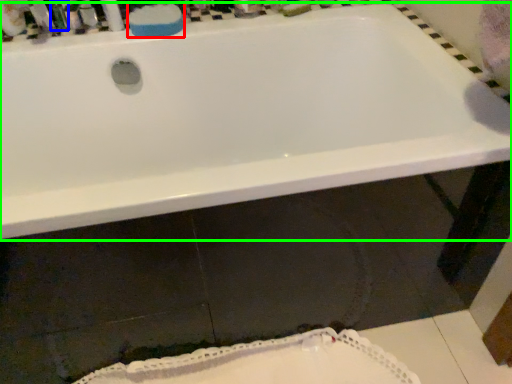
Question: Estimate the real-world distances between objects in this image. Which object is closer to soap (highlighted by a red box), toiletry (highlighted by a blue box) or bathtub (highlighted by a green box)?

Choices:
 (A) toiletry
 (B) bathtub

Answer: (A)